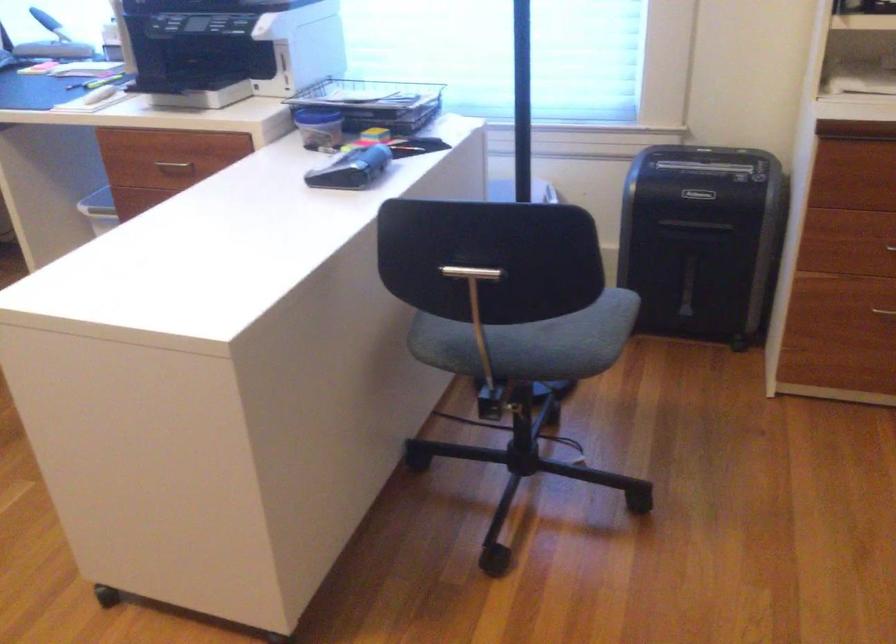
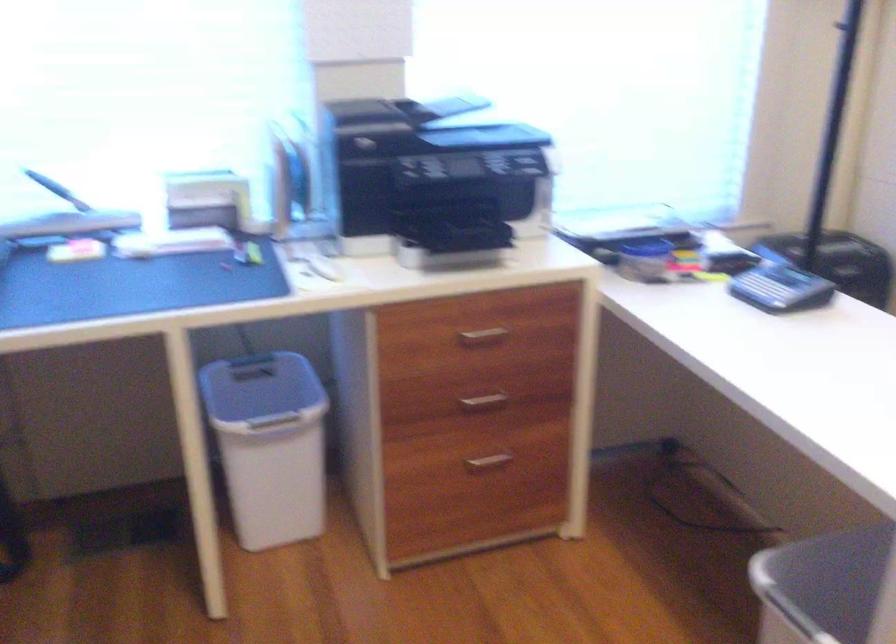
The point at (183, 162) is marked in the first image. Where is the corresponding point in the second image?

(483, 334)